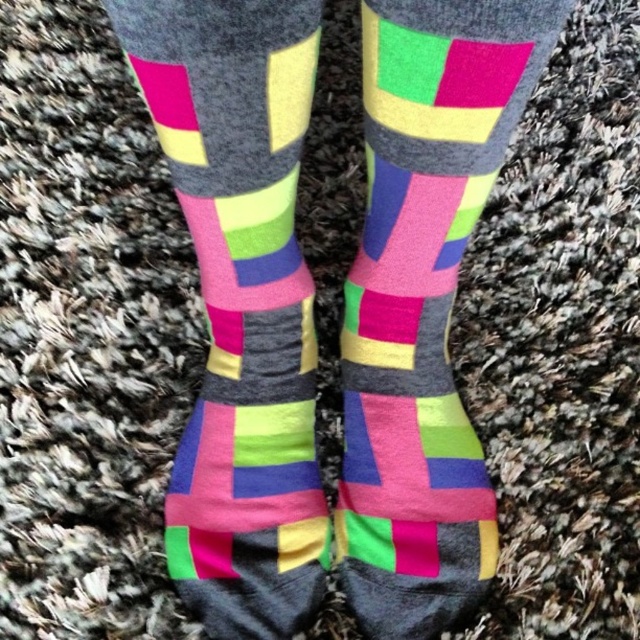
You are trying to decide which pair of socks to wear today. You notice both the matte cotton socks at center and the matte multicolored socks at center. Which pair reaches higher up your leg?

The matte multicolored socks at center reaches higher up the leg since they have a greater height compared to the matte cotton socks at center.

You are a photographer trying to capture the socks on the carpet. Which socks are positioned higher up, the matte cotton socks at center or the matte multicolored socks at center?

The matte cotton socks at center is located above the matte multicolored socks at center, so it is positioned higher up.

You are a photographer setting up a shoot. You need to adjust the focus so that both the matte cotton socks at center and the matte multicolored socks at center are clearly visible. Since the socks are layered, which sock should you focus on first to ensure both are in focus?

You should focus on the matte cotton socks at center first because it is in front of the matte multicolored socks at center. By focusing on the front sock, the depth of field will likely include the sock behind it as well, ensuring both are in focus.